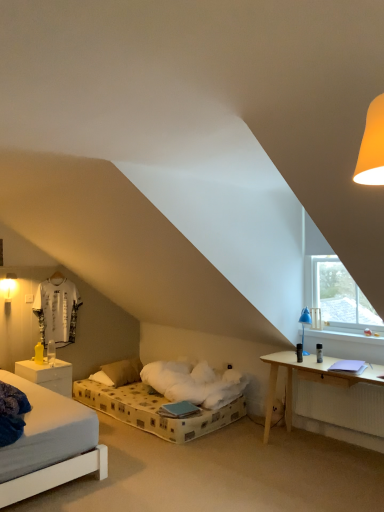
Question: Does blue plastic table lamp at right appear on the left side of white matte nightstand at lower left?

Choices:
 (A) yes
 (B) no

Answer: (B)

Question: Is blue plastic table lamp at right shorter than white matte nightstand at lower left?

Choices:
 (A) yes
 (B) no

Answer: (A)

Question: From a real-world perspective, is blue plastic table lamp at right over white matte nightstand at lower left?

Choices:
 (A) no
 (B) yes

Answer: (B)

Question: Is blue plastic table lamp at right behind white matte nightstand at lower left?

Choices:
 (A) no
 (B) yes

Answer: (A)

Question: From a real-world perspective, is blue plastic table lamp at right under white matte nightstand at lower left?

Choices:
 (A) no
 (B) yes

Answer: (A)

Question: Does blue plastic table lamp at right contain white matte nightstand at lower left?

Choices:
 (A) yes
 (B) no

Answer: (B)

Question: Is white jersey at left placed right next to matte white wall sconce at left?

Choices:
 (A) no
 (B) yes

Answer: (A)

Question: Is white jersey at left smaller than matte white wall sconce at left?

Choices:
 (A) no
 (B) yes

Answer: (A)

Question: From the image's perspective, would you say white jersey at left is shown under matte white wall sconce at left?

Choices:
 (A) no
 (B) yes

Answer: (B)

Question: Would you say white jersey at left contains matte white wall sconce at left?

Choices:
 (A) no
 (B) yes

Answer: (A)

Question: From a real-world perspective, is white jersey at left located beneath matte white wall sconce at left?

Choices:
 (A) no
 (B) yes

Answer: (B)

Question: Is white jersey at left far from matte white wall sconce at left?

Choices:
 (A) yes
 (B) no

Answer: (B)

Question: Does matte white wall sconce at left have a lesser height compared to white matte nightstand at lower left?

Choices:
 (A) yes
 (B) no

Answer: (A)